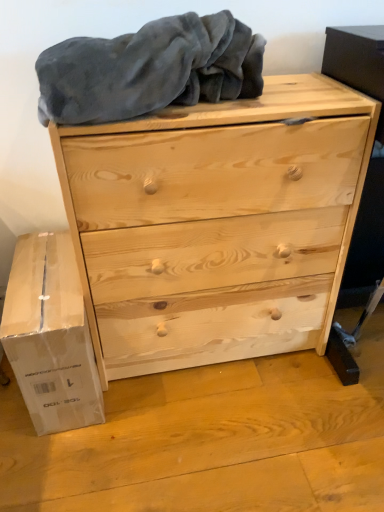
Locate an element on the screen. white cardboard box at lower left is located at coordinates (50, 335).

The width and height of the screenshot is (384, 512). Describe the element at coordinates (150, 69) in the screenshot. I see `gray soft blanket at upper center` at that location.

In order to face natural wood chest of drawers at center, should I rotate leftwards or rightwards?

A 1.545 degree turn to the right will do.

The width and height of the screenshot is (384, 512). What do you see at coordinates (215, 223) in the screenshot? I see `natural wood chest of drawers at center` at bounding box center [215, 223].

Identify the location of white cardboard box at lower left. Image resolution: width=384 pixels, height=512 pixels. (50, 335).

Does gray soft blanket at upper center appear on the left side of natural wood chest of drawers at center?

Yes, gray soft blanket at upper center is to the left of natural wood chest of drawers at center.

How many degrees apart are the facing directions of gray soft blanket at upper center and natural wood chest of drawers at center?

There is a 0.00153-degree angle between the facing directions of gray soft blanket at upper center and natural wood chest of drawers at center.

From a real-world perspective, is gray soft blanket at upper center physically located above or below natural wood chest of drawers at center?

gray soft blanket at upper center is situated higher than natural wood chest of drawers at center in the real world.

Is gray soft blanket at upper center aimed at natural wood chest of drawers at center?

No, gray soft blanket at upper center does not turn towards natural wood chest of drawers at center.

Is white cardboard box at lower left to the left of gray soft blanket at upper center from the viewer's perspective?

Correct, you'll find white cardboard box at lower left to the left of gray soft blanket at upper center.

Is gray soft blanket at upper center surrounded by white cardboard box at lower left?

No, white cardboard box at lower left does not contain gray soft blanket at upper center.

Considering the sizes of objects white cardboard box at lower left and gray soft blanket at upper center in the image provided, who is smaller, white cardboard box at lower left or gray soft blanket at upper center?

Smaller between the two is white cardboard box at lower left.

From a real-world perspective, is white cardboard box at lower left located higher than gray soft blanket at upper center?

Actually, white cardboard box at lower left is physically below gray soft blanket at upper center in the real world.

Consider the image. Which object is positioned more to the left, natural wood chest of drawers at center or gray soft blanket at upper center?

From the viewer's perspective, gray soft blanket at upper center appears more on the left side.

Is natural wood chest of drawers at center directly adjacent to gray soft blanket at upper center?

There is a gap between natural wood chest of drawers at center and gray soft blanket at upper center.

Which is more distant, (86,241) or (169,49)?

The point (86,241) is behind.

Is white cardboard box at lower left positioned behind natural wood chest of drawers at center?

Yes, white cardboard box at lower left is further from the camera.

Which object is positioned more to the right, white cardboard box at lower left or natural wood chest of drawers at center?

From the viewer's perspective, natural wood chest of drawers at center appears more on the right side.

Image resolution: width=384 pixels, height=512 pixels. What are the coordinates of `cardboard box on the left side of natural wood chest of drawers at center` in the screenshot? It's located at (50, 335).

Which point is more forward, (218, 101) or (61, 354)?

The point (218, 101) is more forward.

Which of these two, gray soft blanket at upper center or white cardboard box at lower left, is thinner?

Thinner between the two is gray soft blanket at upper center.

From the image's perspective, which object appears higher, gray soft blanket at upper center or white cardboard box at lower left?

gray soft blanket at upper center appears higher in the image.

Which object is positioned more to the left, gray soft blanket at upper center or white cardboard box at lower left?

From the viewer's perspective, white cardboard box at lower left appears more on the left side.

Is point (218, 142) in front of point (37, 374)?

Yes, it is.

Which of these two, natural wood chest of drawers at center or white cardboard box at lower left, is thinner?

natural wood chest of drawers at center.

Which of these two, natural wood chest of drawers at center or white cardboard box at lower left, is bigger?

With larger size is natural wood chest of drawers at center.

Can you see natural wood chest of drawers at center touching white cardboard box at lower left?

natural wood chest of drawers at center and white cardboard box at lower left are clearly separated.

Locate an element on the screen. blanket that appears above the natural wood chest of drawers at center (from a real-world perspective) is located at coordinates (150, 69).

In the image, there is a gray soft blanket at upper center. In order to click on cardboard box below it (from a real-world perspective) in this screenshot , I will do `click(50, 335)`.

Which object lies nearer to the anchor point natural wood chest of drawers at center, gray soft blanket at upper center or white cardboard box at lower left?

gray soft blanket at upper center.

When comparing their distances from natural wood chest of drawers at center, does white cardboard box at lower left or gray soft blanket at upper center seem closer?

gray soft blanket at upper center is closer to natural wood chest of drawers at center.

Considering their positions, is gray soft blanket at upper center positioned further to white cardboard box at lower left than natural wood chest of drawers at center?

Based on the image, gray soft blanket at upper center appears to be further to white cardboard box at lower left.

From the image, which object appears to be nearer to gray soft blanket at upper center, natural wood chest of drawers at center or white cardboard box at lower left?

Based on the image, natural wood chest of drawers at center appears to be nearer to gray soft blanket at upper center.

Estimate the real-world distances between objects in this image. Which object is further from white cardboard box at lower left, natural wood chest of drawers at center or gray soft blanket at upper center?

gray soft blanket at upper center is further to white cardboard box at lower left.

Estimate the real-world distances between objects in this image. Which object is further from gray soft blanket at upper center, white cardboard box at lower left or natural wood chest of drawers at center?

Based on the image, white cardboard box at lower left appears to be further to gray soft blanket at upper center.

The image size is (384, 512). What are the coordinates of `the chest of drawers between gray soft blanket at upper center and white cardboard box at lower left vertically` in the screenshot? It's located at (215, 223).